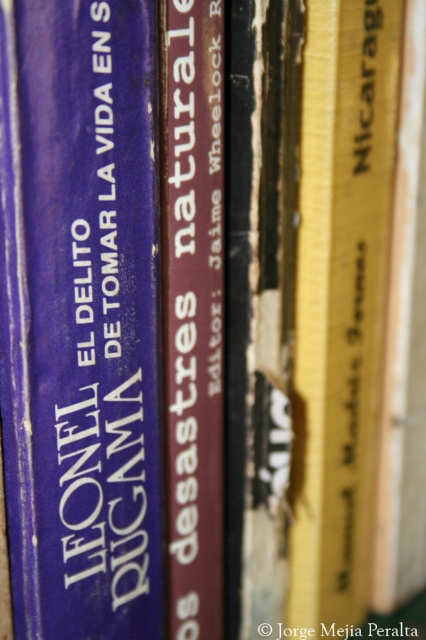
You are a librarian who needs to place a new book on the shelf. The shelf you are standing at is 24 inches away from you. You have a matte blue book at center that you want to place on the shelf. Can you place it there without moving closer?

The matte blue book at center is currently 18.22 inches away from the viewer. Since the shelf is 24 inches away, which is farther than the current distance of the book, you can place it on the shelf without needing to move closer.

You are a librarian organizing books on a shelf. You notice two points marked on the shelf. The first point is at coordinate point(x=121, y=410) and the second is at point(x=316, y=564). If you place a book at the first point, will it block the view of the second point from your current position?

Yes, placing a book at point(x=121, y=410) will block the view of point(x=316, y=564) because point(x=121, y=410) is in front of point(x=316, y=564) according to their positions.

You are organizing a bookshelf and have two books to place side by side. The matte blue book at center and the maroon leather book at center. If you want to arrange them so that the wider book is on the left, which book should you place on the left?

The matte blue book at center might be wider than maroon leather book at center, so you should place the matte blue book at center on the left to have the wider book there.